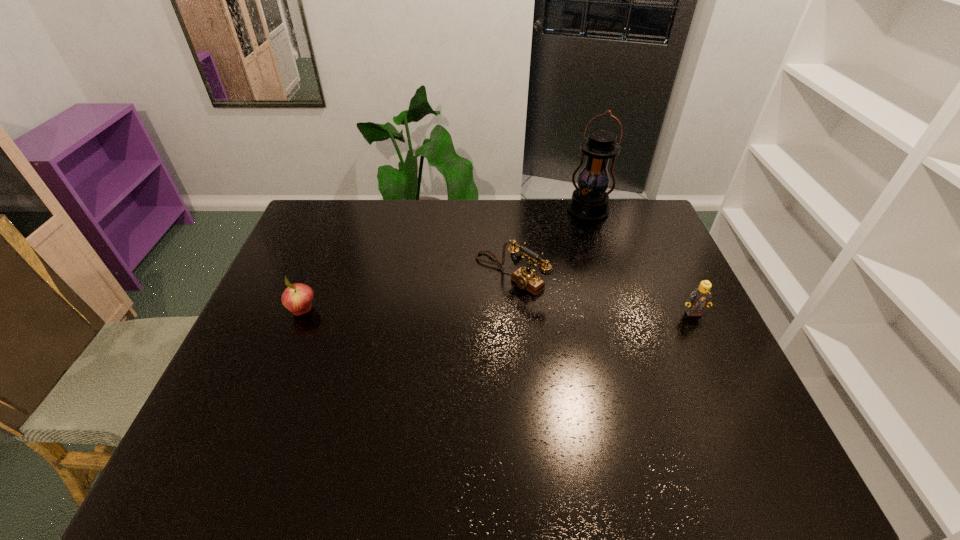
The height and width of the screenshot is (540, 960). What are the coordinates of `the leftmost object` in the screenshot? It's located at (297, 298).

Find the location of a particular element. The width and height of the screenshot is (960, 540). Lego is located at coordinates (700, 298).

Identify the location of the third object from right to left. The width and height of the screenshot is (960, 540). (527, 279).

This screenshot has height=540, width=960. I want to click on telephone, so click(527, 279).

Locate an element on the screen. The image size is (960, 540). the tallest object is located at coordinates (589, 202).

Identify the location of the third object from left to right. This screenshot has width=960, height=540. (589, 202).

You are a GUI agent. You are given a task and a screenshot of the screen. Output one action in this format:
    pyautogui.click(x=<x>, y=<y>)
    Task: Click on the free location located 0.100m on the front of the leftmost object
    Image resolution: width=960 pixels, height=540 pixels.
    Given the screenshot: What is the action you would take?
    pyautogui.click(x=287, y=350)

Where is `free space located in front of the Lego`? Image resolution: width=960 pixels, height=540 pixels. free space located in front of the Lego is located at coordinates (747, 426).

This screenshot has height=540, width=960. I want to click on vacant region located on the front-facing side of the third nearest object, so click(389, 358).

Where is `vacant region located on the front-facing side of the third nearest object`? The height and width of the screenshot is (540, 960). vacant region located on the front-facing side of the third nearest object is located at coordinates (385, 360).